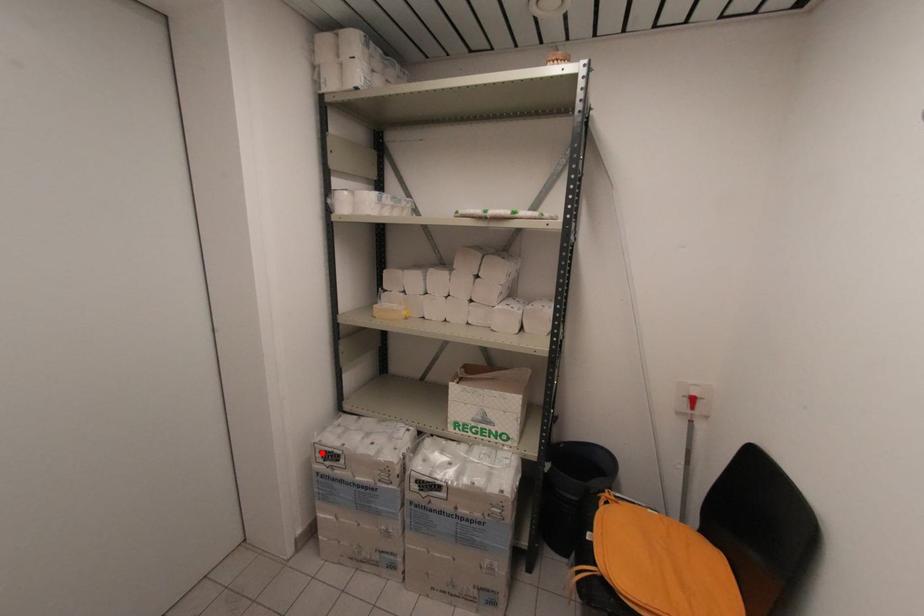
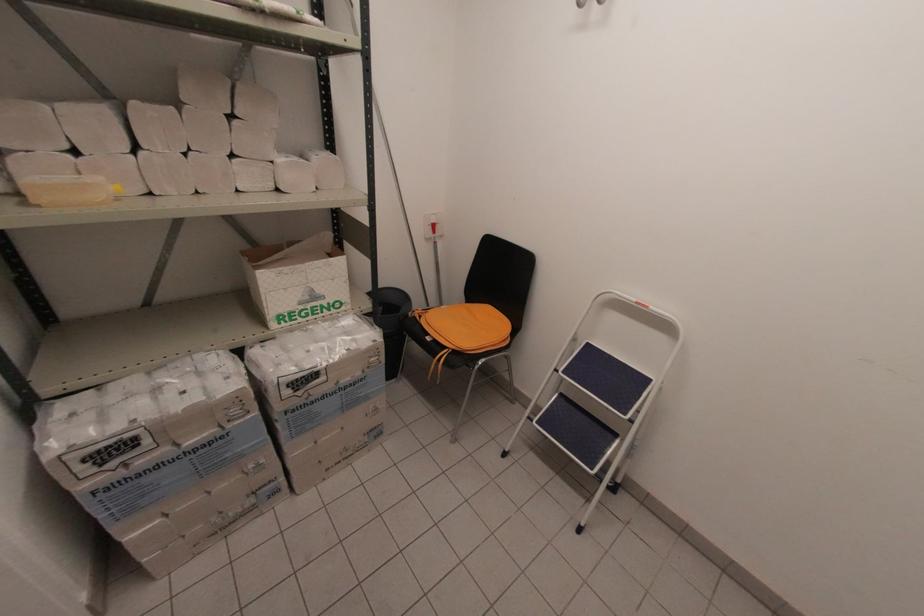
The point at the highlighted location is marked in the first image. Where is the corresponding point in the second image?

(84, 463)